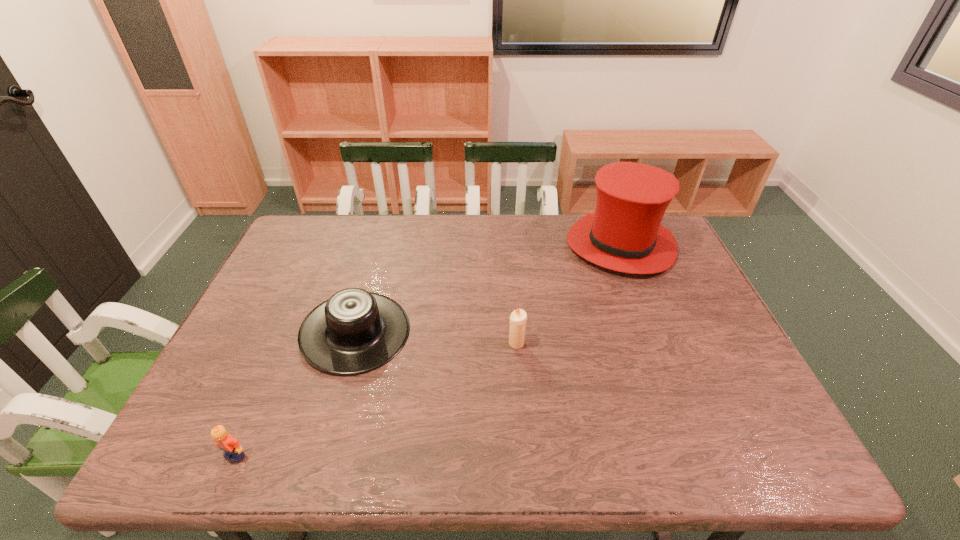
You are a GUI agent. You are given a task and a screenshot of the screen. Output one action in this format:
    pyautogui.click(x=<x>, y=<y>)
    Task: Click on the object positioned at the far edge
    The image size is (960, 540).
    Given the screenshot: What is the action you would take?
    pyautogui.click(x=624, y=233)

This screenshot has height=540, width=960. I want to click on object present at the near edge, so click(233, 451).

Where is `object present at the left edge`? This screenshot has height=540, width=960. object present at the left edge is located at coordinates (233, 451).

Find the location of `object that is at the right edge`. object that is at the right edge is located at coordinates (624, 233).

You are a GUI agent. You are given a task and a screenshot of the screen. Output one action in this format:
    pyautogui.click(x=<x>, y=<y>)
    Task: Click on the object located at the near left corner
    Image resolution: width=960 pixels, height=540 pixels.
    Given the screenshot: What is the action you would take?
    pyautogui.click(x=233, y=451)

I want to click on object located in the far right corner section of the desktop, so click(624, 233).

At what (x,y) coordinates should I click in order to perform the action: click on vacant space at the far edge of the desktop. Please return your answer as a coordinate pair (x, y). This screenshot has height=540, width=960. Looking at the image, I should click on (564, 254).

You are a GUI agent. You are given a task and a screenshot of the screen. Output one action in this format:
    pyautogui.click(x=<x>, y=<y>)
    Task: Click on the free location at the near edge of the desktop
    
    Given the screenshot: What is the action you would take?
    pyautogui.click(x=446, y=466)

Locate an element on the screen. Image resolution: width=960 pixels, height=540 pixels. vacant area at the right edge of the desktop is located at coordinates (643, 281).

Image resolution: width=960 pixels, height=540 pixels. Identify the location of free region at the near left corner. (225, 458).